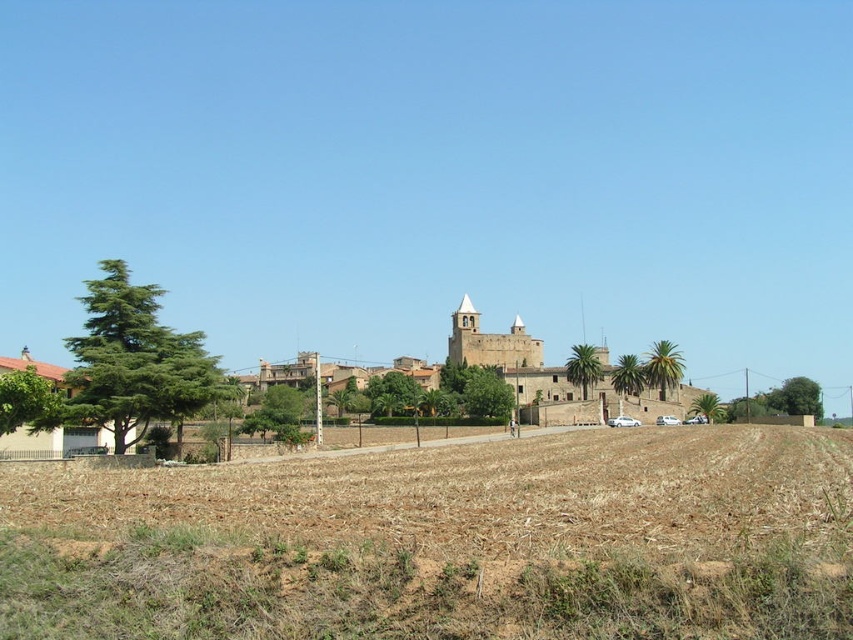
Is brown soil at lower center below brown stone town at center?

Indeed, brown soil at lower center is positioned under brown stone town at center.

Is brown soil at lower center to the left of brown stone town at center from the viewer's perspective?

No, brown soil at lower center is not to the left of brown stone town at center.

Based on the photo, measure the distance between point (514, 588) and camera.

Point (514, 588) and camera are 52.43 meters apart from each other.

This screenshot has width=853, height=640. I want to click on brown soil at lower center, so tap(445, 541).